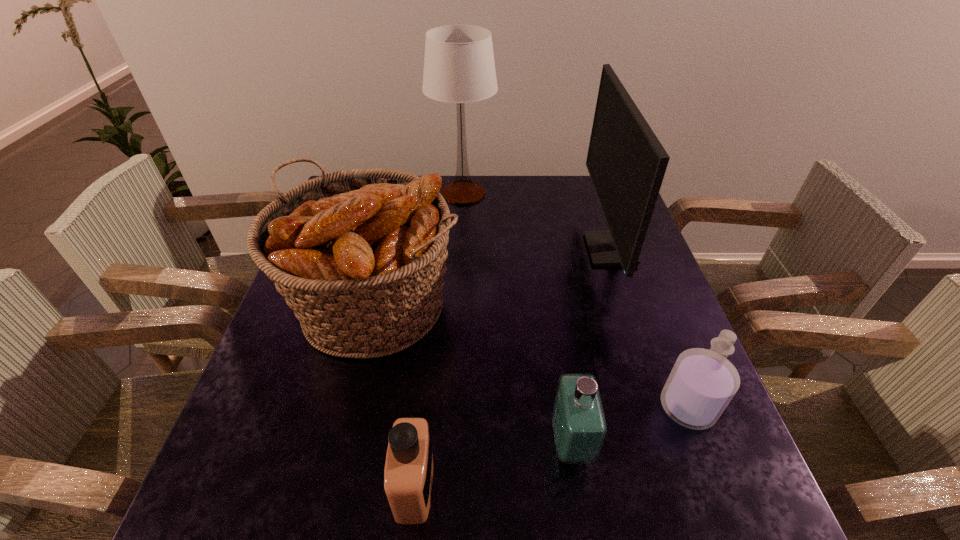
Locate an element on the screen. vacant space that satisfies the following two spatial constraints: 1. on the front-facing side of the computer monitor; 2. on the left side of the rightmost perfume is located at coordinates (663, 407).

Locate an element on the screen. The height and width of the screenshot is (540, 960). free space that satisfies the following two spatial constraints: 1. above the cylindrical shade of the rightmost perfume; 2. on the right side of the table lamp is located at coordinates (452, 407).

What are the coordinates of `free point that satisfies the following two spatial constraints: 1. on the front side of the rightmost perfume; 2. on the left side of the basket` in the screenshot? It's located at (352, 407).